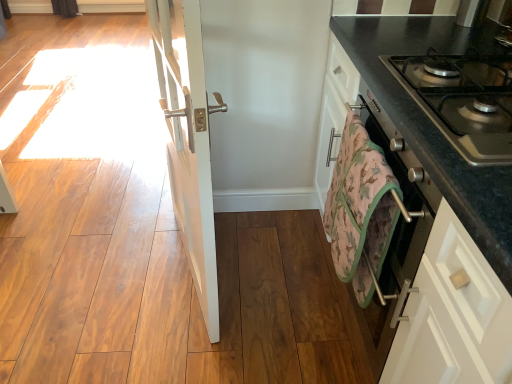
Looking at this image, what is the approximate width of camouflage-patterned towel at lower right?

camouflage-patterned towel at lower right is 3.68 inches wide.

Where is `black granite countertop at right`? black granite countertop at right is located at coordinates pyautogui.click(x=435, y=126).

The width and height of the screenshot is (512, 384). Describe the element at coordinates (435, 126) in the screenshot. I see `black granite countertop at right` at that location.

What is the approximate width of metallic gray gas stove at right?

metallic gray gas stove at right is 16.59 inches wide.

Describe the element at coordinates (188, 140) in the screenshot. Image resolution: width=512 pixels, height=384 pixels. I see `white glossy door at center` at that location.

I want to click on camouflage-patterned towel at lower right, so coord(361,210).

Is black granite countertop at right positioned before white glossy door at center?

Yes, black granite countertop at right is in front of white glossy door at center.

From a real-world perspective, is black granite countertop at right beneath white glossy door at center?

Yes, from a real-world perspective, black granite countertop at right is below white glossy door at center.

You are a GUI agent. You are given a task and a screenshot of the screen. Output one action in this format:
    pyautogui.click(x=<x>, y=<y>)
    Task: Click on the door located behind the black granite countertop at right
    
    Given the screenshot: What is the action you would take?
    pyautogui.click(x=188, y=140)

In terms of width, does black granite countertop at right look wider or thinner when compared to white glossy door at center?

Considering their sizes, black granite countertop at right looks broader than white glossy door at center.

From the image's perspective, between metallic gray gas stove at right and black granite countertop at right, which one is located above?

metallic gray gas stove at right.

Is metallic gray gas stove at right aimed at black granite countertop at right?

No, metallic gray gas stove at right is not oriented towards black granite countertop at right.

Which of these two, metallic gray gas stove at right or black granite countertop at right, is wider?

With larger width is black granite countertop at right.

Is metallic gray gas stove at right at the left side of black granite countertop at right?

Yes, metallic gray gas stove at right is to the left of black granite countertop at right.

Is camouflage-patterned towel at lower right wider or thinner than white glossy door at center?

In the image, camouflage-patterned towel at lower right appears to be wider than white glossy door at center.

How far apart are camouflage-patterned towel at lower right and white glossy door at center?

camouflage-patterned towel at lower right and white glossy door at center are 43.94 centimeters apart.

Is camouflage-patterned towel at lower right positioned before white glossy door at center?

No, it is behind white glossy door at center.

Looking at this image, considering the sizes of objects black granite countertop at right and metallic gray gas stove at right in the image provided, who is smaller, black granite countertop at right or metallic gray gas stove at right?

Smaller between the two is metallic gray gas stove at right.

Considering the sizes of objects black granite countertop at right and metallic gray gas stove at right in the image provided, who is shorter, black granite countertop at right or metallic gray gas stove at right?

Standing shorter between the two is metallic gray gas stove at right.

What's the angular difference between black granite countertop at right and metallic gray gas stove at right's facing directions?

The angular difference between black granite countertop at right and metallic gray gas stove at right is 0.151 degrees.

From a real-world perspective, is metallic gray gas stove at right over white glossy door at center?

Yes, from a real-world perspective, metallic gray gas stove at right is on top of white glossy door at center.

In terms of width, does metallic gray gas stove at right look wider or thinner when compared to white glossy door at center?

Clearly, metallic gray gas stove at right has more width compared to white glossy door at center.

Find the location of a particular element. door located behind the metallic gray gas stove at right is located at coordinates (188, 140).

Between point (425, 78) and point (193, 150), which one is positioned in front?

Positioned in front is point (193, 150).

From the picture: Choose the correct answer: Is camouflage-patterned towel at lower right inside metallic gray gas stove at right or outside it?

camouflage-patterned towel at lower right exists outside the volume of metallic gray gas stove at right.

From the image's perspective, is camouflage-patterned towel at lower right under metallic gray gas stove at right?

Correct, camouflage-patterned towel at lower right appears lower than metallic gray gas stove at right in the image.

From a real-world perspective, is camouflage-patterned towel at lower right physically located above or below metallic gray gas stove at right?

From a real-world perspective, camouflage-patterned towel at lower right is physically below metallic gray gas stove at right.

Is camouflage-patterned towel at lower right smaller than metallic gray gas stove at right?

Yes.

Is camouflage-patterned towel at lower right placed right next to black granite countertop at right?

camouflage-patterned towel at lower right and black granite countertop at right are not in contact.

Based on the photo, considering the relative sizes of camouflage-patterned towel at lower right and black granite countertop at right in the image provided, is camouflage-patterned towel at lower right bigger than black granite countertop at right?

Actually, camouflage-patterned towel at lower right might be smaller than black granite countertop at right.

Which point is more distant from viewer, [345,213] or [479,183]?

Point [345,213]

From the image's perspective, who appears lower, camouflage-patterned towel at lower right or black granite countertop at right?

camouflage-patterned towel at lower right.

You are a GUI agent. You are given a task and a screenshot of the screen. Output one action in this format:
    pyautogui.click(x=<x>, y=<y>)
    Task: Click on the door above the black granite countertop at right (from a real-world perspective)
    Image resolution: width=512 pixels, height=384 pixels.
    Given the screenshot: What is the action you would take?
    pyautogui.click(x=188, y=140)

At what (x,y) coordinates should I click in order to perform the action: click on countertop below the metallic gray gas stove at right (from the image's perspective). Please return your answer as a coordinate pair (x, y). Image resolution: width=512 pixels, height=384 pixels. Looking at the image, I should click on (435, 126).

Based on their spatial positions, is metallic gray gas stove at right or camouflage-patterned towel at lower right closer to white glossy door at center?

Based on the image, camouflage-patterned towel at lower right appears to be nearer to white glossy door at center.

From the image, which object appears to be farther from white glossy door at center, camouflage-patterned towel at lower right or metallic gray gas stove at right?

metallic gray gas stove at right lies further to white glossy door at center than the other object.

Estimate the real-world distances between objects in this image. Which object is closer to black granite countertop at right, metallic gray gas stove at right or camouflage-patterned towel at lower right?

metallic gray gas stove at right is positioned closer to the anchor black granite countertop at right.

When comparing their distances from black granite countertop at right, does metallic gray gas stove at right or white glossy door at center seem closer?

metallic gray gas stove at right is closer to black granite countertop at right.

From the image, which object appears to be farther from white glossy door at center, metallic gray gas stove at right or black granite countertop at right?

Among the two, metallic gray gas stove at right is located further to white glossy door at center.

Estimate the real-world distances between objects in this image. Which object is closer to metallic gray gas stove at right, white glossy door at center or black granite countertop at right?

black granite countertop at right is positioned closer to the anchor metallic gray gas stove at right.

Which object lies nearer to the anchor point black granite countertop at right, white glossy door at center or metallic gray gas stove at right?

The object closer to black granite countertop at right is metallic gray gas stove at right.

Consider the image. When comparing their distances from camouflage-patterned towel at lower right, does black granite countertop at right or white glossy door at center seem closer?

Based on the image, black granite countertop at right appears to be nearer to camouflage-patterned towel at lower right.

Where is `gas stove located between white glossy door at center and black granite countertop at right in the left-right direction`? gas stove located between white glossy door at center and black granite countertop at right in the left-right direction is located at coordinates (463, 100).

This screenshot has width=512, height=384. In order to click on gas stove between black granite countertop at right and camouflage-patterned towel at lower right in the front-back direction in this screenshot , I will do `click(463, 100)`.

This screenshot has height=384, width=512. Find the location of `beach towel located between white glossy door at center and metallic gray gas stove at right in the left-right direction`. beach towel located between white glossy door at center and metallic gray gas stove at right in the left-right direction is located at coordinates (361, 210).

Locate an element on the screen. beach towel between white glossy door at center and black granite countertop at right from left to right is located at coordinates (361, 210).